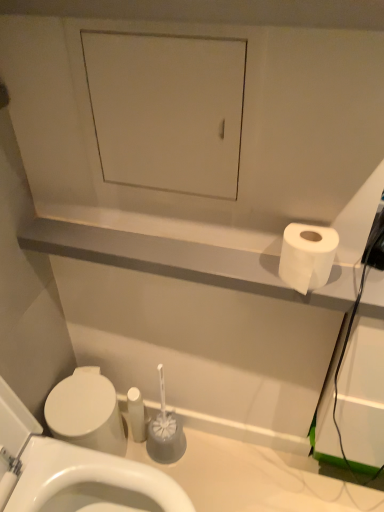
Locate an element on the screen. The image size is (384, 512). blank space to the left of white matte toilet paper at right is located at coordinates (233, 265).